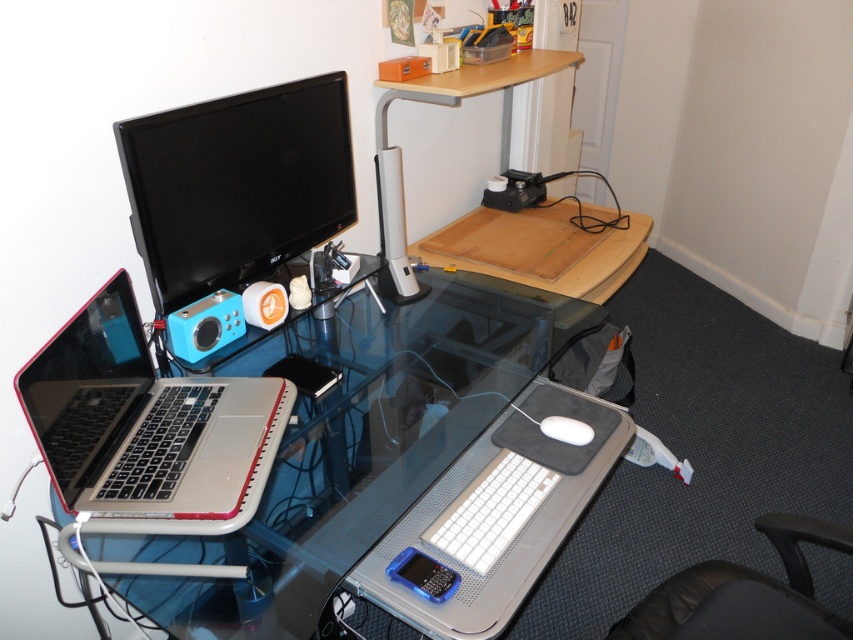
In the scene shown: You are a delivery robot with a height of 1.2 meters. You need to deliver a package to the point marked by the coordinate point at point (743, 612). The camera is positioned at your current location. Can you reach the point without bending down?

The distance between point (743, 612) and the camera is 1.13 meters. Since the robot is 1.2 meters tall, it can reach the point without bending down as its height is slightly taller than the distance required.

You are organizing the desk and need to move the white plastic speaker at center. Where is the black glossy monitor at upper left located in relation to the speaker?

The black glossy monitor at upper left is positioned under the white plastic speaker at center.

You need to place a new item between the black glossy monitor at upper left and the white plastic speaker at center. Which side of the speaker should you place it on to ensure it doesn

The black glossy monitor at upper left is bigger than the white plastic speaker at center, so placing the new item to the right of the speaker would maintain spacing between the larger monitor and the smaller speaker.